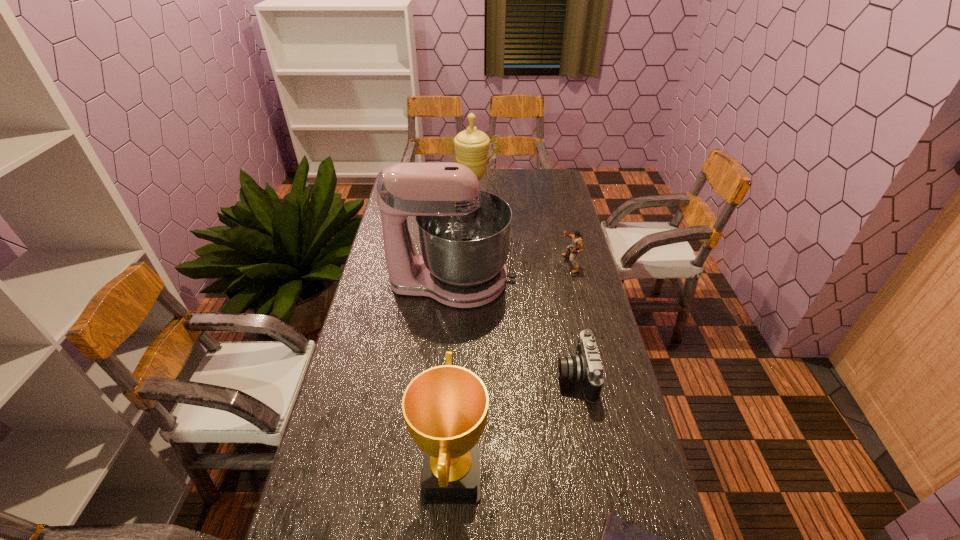
In the image, there is a desktop. At what (x,y) coordinates should I click in order to perform the action: click on vacant space at the right edge. Please return your answer as a coordinate pair (x, y). The height and width of the screenshot is (540, 960). Looking at the image, I should click on (551, 276).

This screenshot has width=960, height=540. I want to click on vacant region at the far right corner of the desktop, so click(539, 180).

Identify the location of vacant area that lies between the camera and the fourth shortest object. This screenshot has height=540, width=960. (514, 425).

The height and width of the screenshot is (540, 960). In order to click on free area in between the camera and the farthest object in this screenshot , I will do `click(524, 298)`.

At what (x,y) coordinates should I click in order to perform the action: click on free space between the puncher and the camera. Please return your answer as a coordinate pair (x, y). Looking at the image, I should click on (573, 320).

The width and height of the screenshot is (960, 540). I want to click on vacant region between the farthest object and the fifth tallest object, so click(x=524, y=298).

Locate an element on the screen. vacant space in between the mixer and the third nearest object is located at coordinates (515, 328).

Select which object is the third closest to the third tallest object. Please provide its 2D coordinates. Your answer should be formatted as a tuple, i.e. [(x, y)], where the tuple contains the x and y coordinates of a point satisfying the conditions above.

[(464, 232)]

Image resolution: width=960 pixels, height=540 pixels. I want to click on the third closest object to the third shortest object, so 585,367.

Locate an element on the screen. vacant space that satisfies the following two spatial constraints: 1. at the front of the trophy cup with handles; 2. on the front-facing side of the third tallest object is located at coordinates (468, 474).